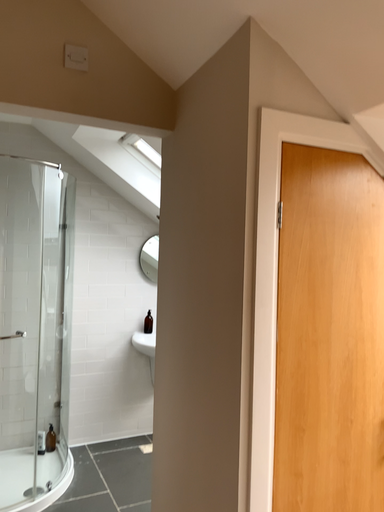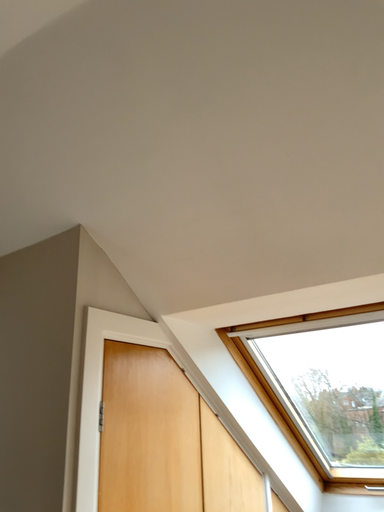
Question: Which way did the camera rotate in the video?

Choices:
 (A) rotated downward
 (B) rotated upward

Answer: (B)